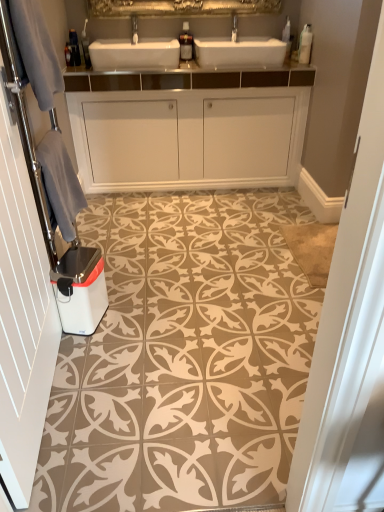
The image size is (384, 512). Find the location of `free location in front of white glossy dishwasher at lower left`. free location in front of white glossy dishwasher at lower left is located at coordinates (86, 348).